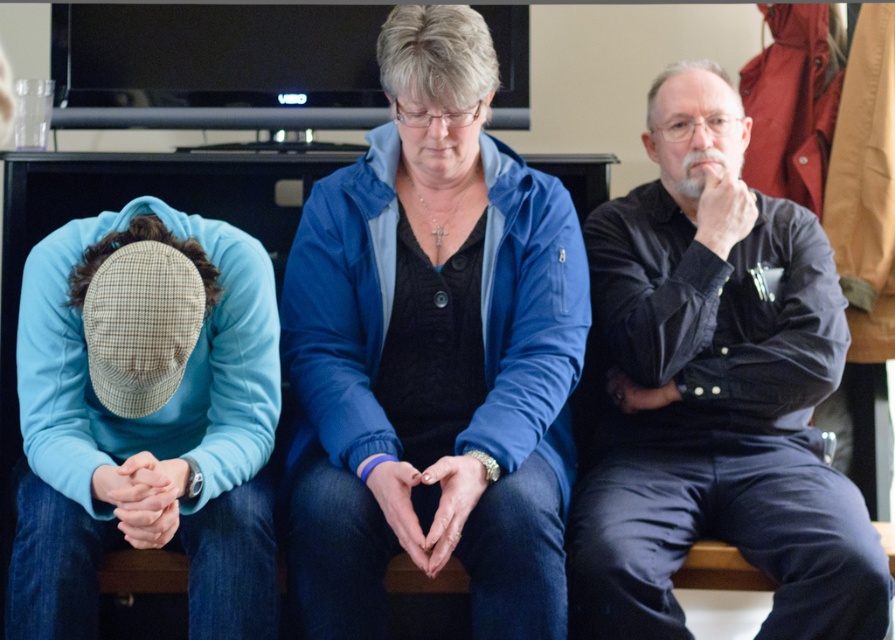
You are a photographer trying to capture a candid shot of the blue fabric jacket at center and the black denim shirt at right. The camera you are using has a minimum focus distance of 12 inches. Will you be able to focus on both subjects clearly without moving the camera or the subjects?

The blue fabric jacket at center is 11.71 inches from the black denim shirt at right, which is less than the camera minimum focus distance of 12 inches. Therefore, the camera cannot focus on both subjects clearly without moving them closer or adjusting the camera position.

You are standing in the living room and want to hand a gift to the person wearing the blue fabric jacket at center. Where should you walk to in order to reach them?

The blue fabric jacket at center is located at point 0.552 on the x axis and 0.485 on the y axis, so you should walk towards the coordinates (433, 353) to reach them.